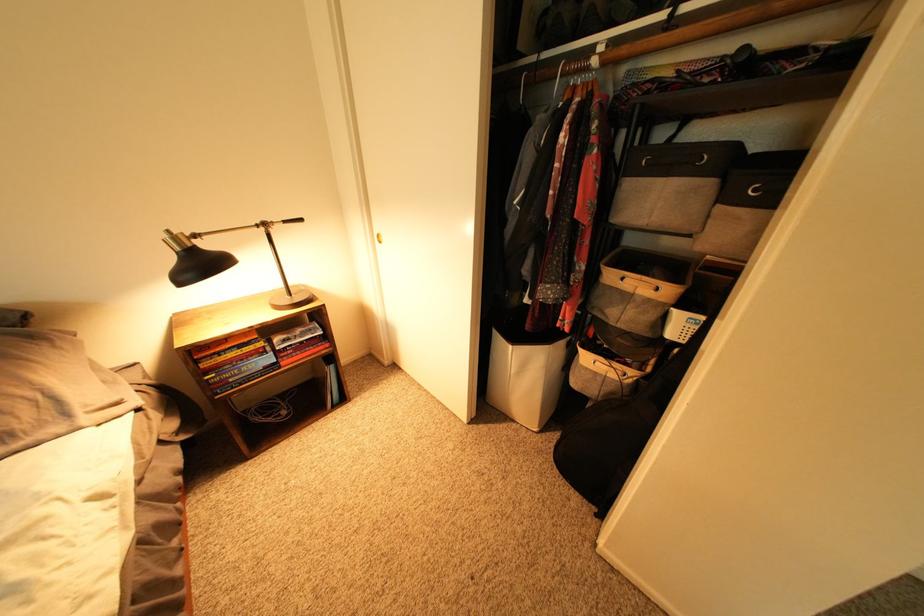
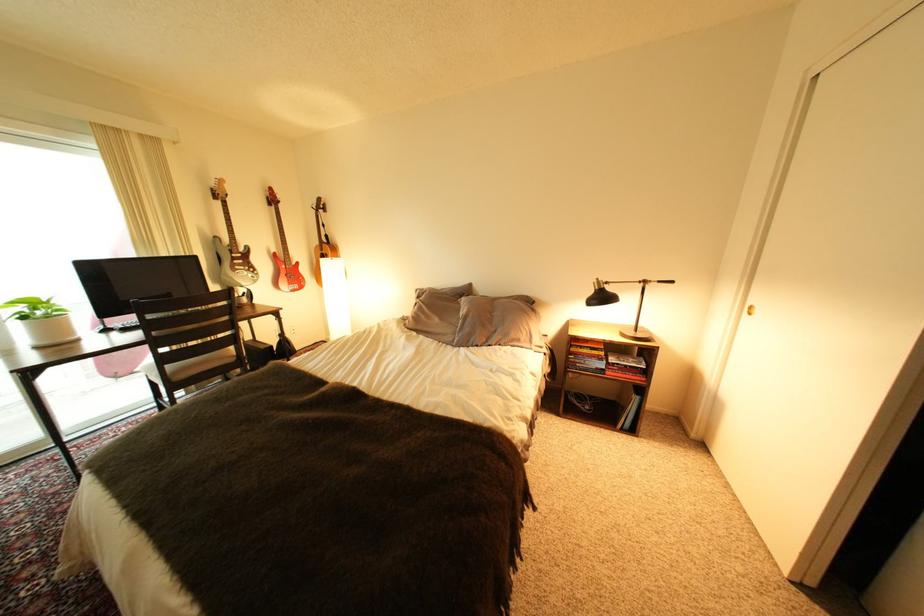
Where in the second image is the point corresponding to (x=290, y=350) from the first image?

(623, 363)